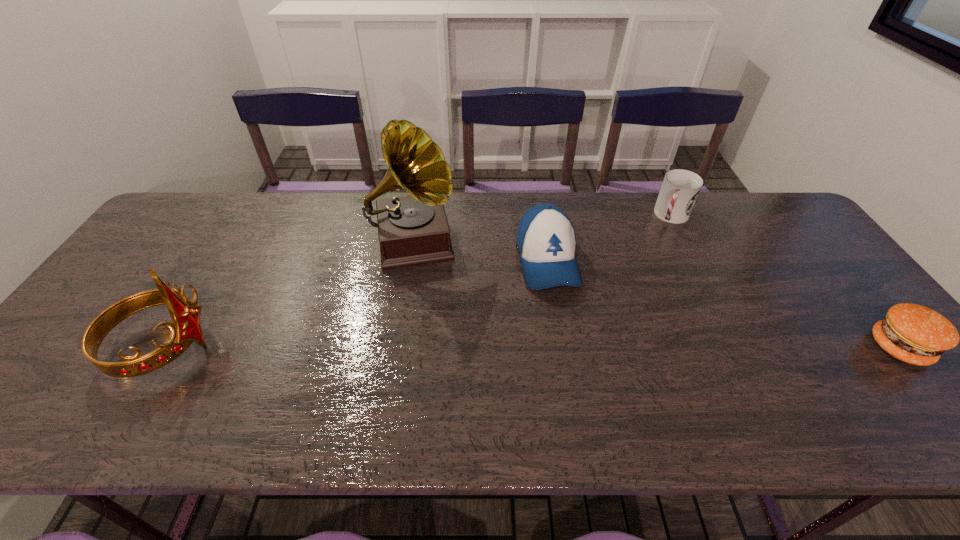
Locate an element on the screen. Image resolution: width=960 pixels, height=540 pixels. vacant space at the far left corner of the desktop is located at coordinates (166, 227).

Where is `free point between the patty and the third object from right to left`? Image resolution: width=960 pixels, height=540 pixels. free point between the patty and the third object from right to left is located at coordinates click(x=723, y=304).

This screenshot has height=540, width=960. Find the location of `vacant space that is in between the shortest object and the tiara`. vacant space that is in between the shortest object and the tiara is located at coordinates (532, 347).

The height and width of the screenshot is (540, 960). Find the location of `empty space that is in between the phonograph record and the third object from right to left`. empty space that is in between the phonograph record and the third object from right to left is located at coordinates (481, 252).

Locate an element on the screen. This screenshot has height=540, width=960. vacant space that's between the third object from right to left and the leftmost object is located at coordinates (355, 304).

This screenshot has height=540, width=960. Identify the location of free spot between the tallest object and the baseball cap. (481, 252).

The image size is (960, 540). I want to click on vacant space in between the baseball cap and the shortest object, so click(723, 304).

I want to click on free space between the second object from right to left and the second tallest object, so click(x=418, y=282).

The width and height of the screenshot is (960, 540). Find the location of `vacant area between the phonograph record and the shortest object`. vacant area between the phonograph record and the shortest object is located at coordinates (657, 295).

You are a GUI agent. You are given a task and a screenshot of the screen. Output one action in this format:
    pyautogui.click(x=<x>, y=<y>)
    Task: Click on the blank region between the third object from left to right and the phonograph record
    The width and height of the screenshot is (960, 540).
    Given the screenshot: What is the action you would take?
    point(481,252)